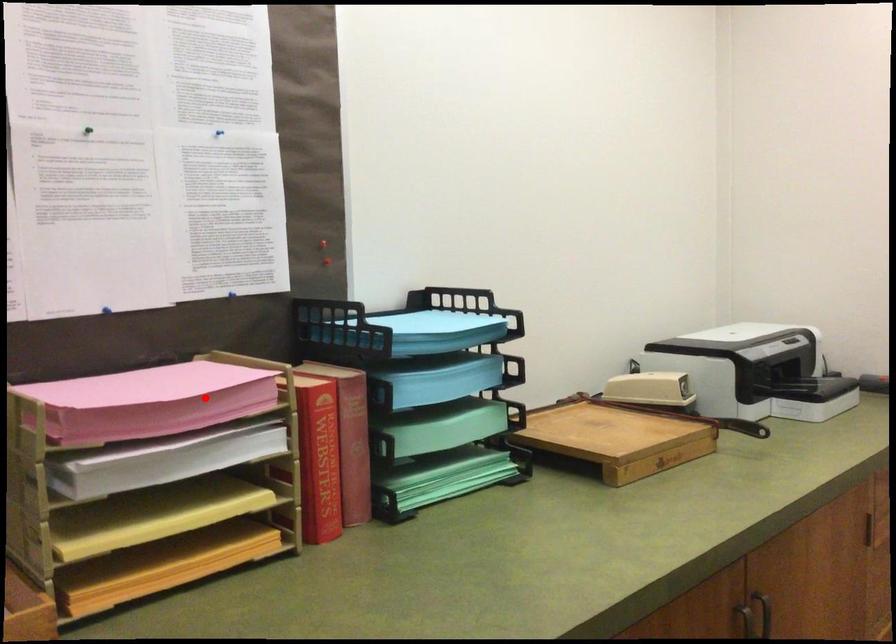
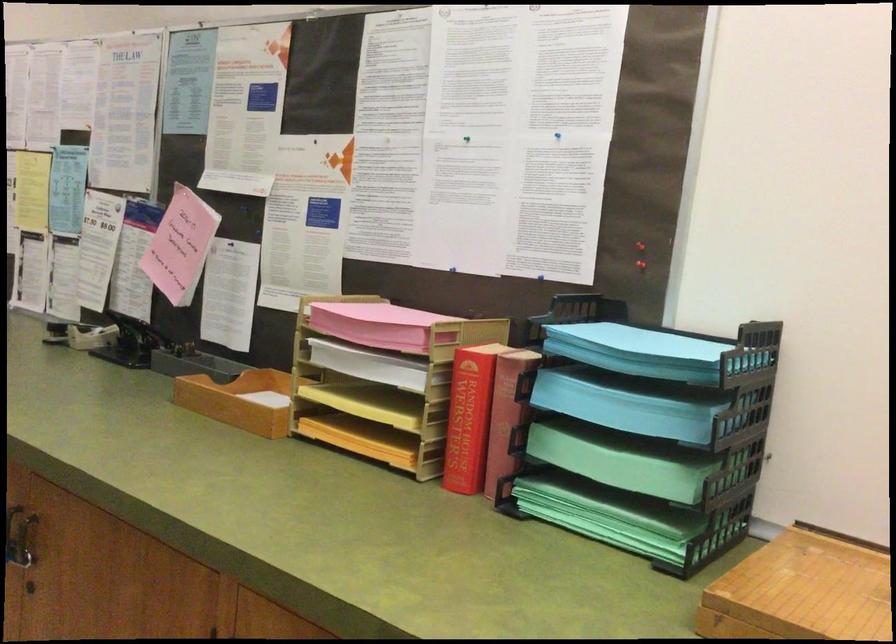
Question: I am providing you with two images of the same scene from different viewpoints. Given a red point in image1, look at the same physical point in image2. Is it:

Choices:
 (A) Closer to the viewpoint
 (B) Farther from the viewpoint

Answer: (B)